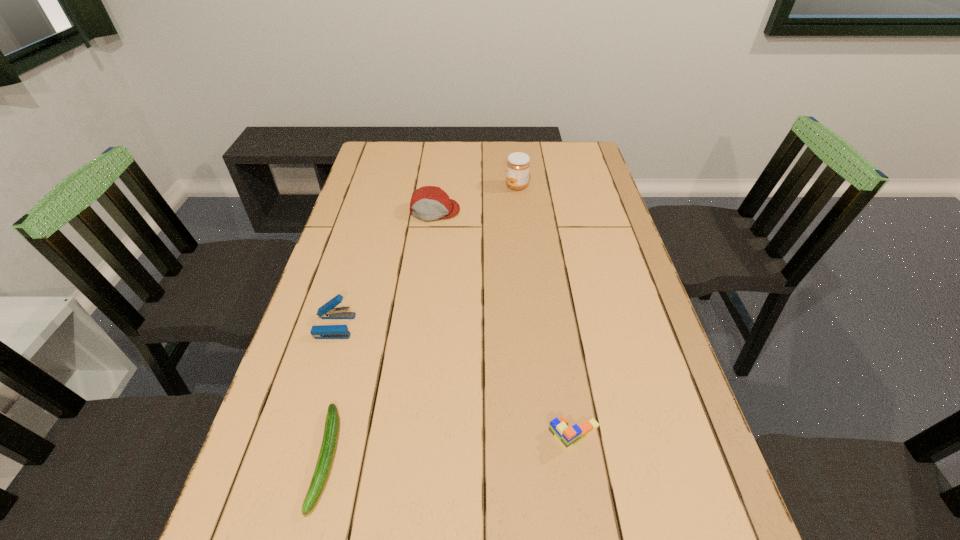
The width and height of the screenshot is (960, 540). Identify the location of unoccupied area between the tallest object and the shortest object. (421, 322).

In order to click on vacant space that is in between the stapler and the tallest object in this screenshot , I will do `click(425, 256)`.

You are a GUI agent. You are given a task and a screenshot of the screen. Output one action in this format:
    pyautogui.click(x=<x>, y=<y>)
    Task: Click on the vacant area between the second shortest object and the fourth nearest object
    The image size is (960, 540).
    Given the screenshot: What is the action you would take?
    pyautogui.click(x=505, y=323)

This screenshot has height=540, width=960. In order to click on free spot between the third farthest object and the shortest object in this screenshot , I will do `click(330, 392)`.

This screenshot has width=960, height=540. In order to click on vacant area between the third nearest object and the zucchini in this screenshot , I will do `click(330, 392)`.

The image size is (960, 540). What are the coordinates of `free spot between the Lego and the stapler` in the screenshot? It's located at (454, 381).

This screenshot has width=960, height=540. In order to click on vacant area that lies between the zucchini and the fourth nearest object in this screenshot , I will do `click(380, 334)`.

Where is `free space between the shortest object and the Lego`? free space between the shortest object and the Lego is located at coordinates (450, 447).

Where is `the closest object relative to the stapler`? This screenshot has width=960, height=540. the closest object relative to the stapler is located at coordinates (331, 430).

Locate an element on the screen. Image resolution: width=960 pixels, height=540 pixels. the second closest object to the jam is located at coordinates (328, 311).